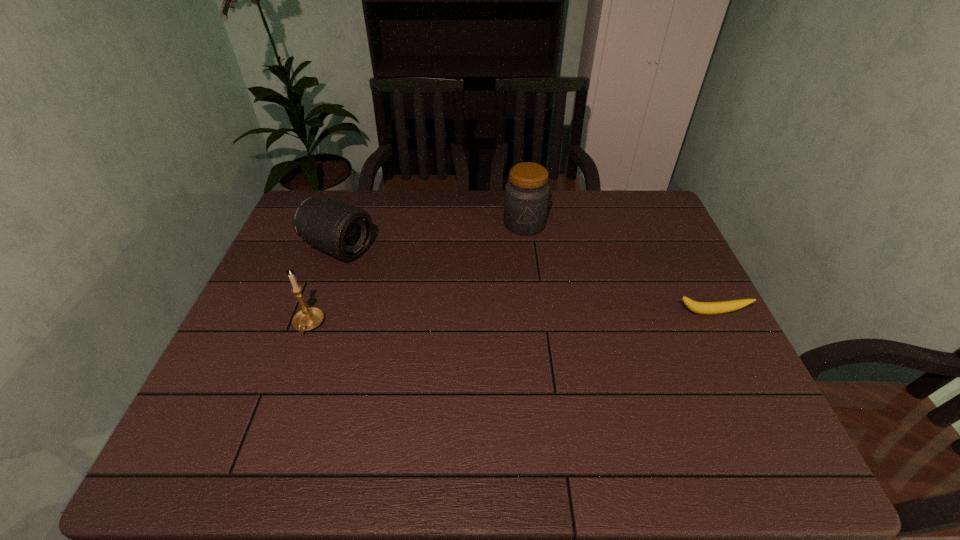
Find the location of a particular element. This screenshot has height=540, width=960. vacant space on the desktop that is between the candle holder and the rightmost object and is positioned on the surface of the third object from left to right near the warning symbol is located at coordinates (520, 319).

The image size is (960, 540). In order to click on vacant space on the desktop that is between the candle holder and the shortest object and is positioned on the surface of the third tallest object in this screenshot , I will do `click(504, 319)`.